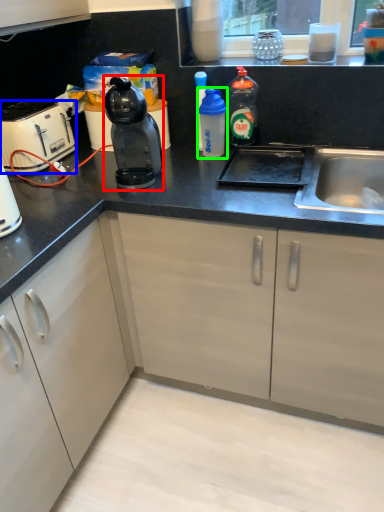
Question: Based on their relative distances, which object is farther from kitchen appliance (highlighted by a red box)? Choose from home appliance (highlighted by a blue box) and bottle (highlighted by a green box).

Choices:
 (A) home appliance
 (B) bottle

Answer: (A)